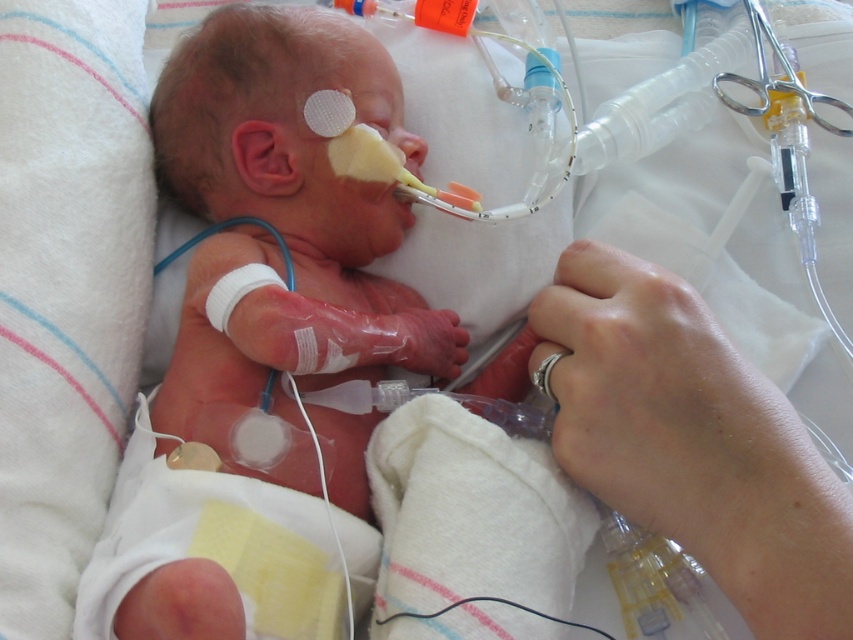
Question: Among these objects, which one is nearest to the camera?

Choices:
 (A) silver metallic teething ring at lower center
 (B) clear plastic tube at lower right

Answer: (B)

Question: Does clear plastic tube at lower right come in front of silver metallic teething ring at lower center?

Choices:
 (A) no
 (B) yes

Answer: (B)

Question: Among these objects, which one is farthest from the camera?

Choices:
 (A) silver metallic teething ring at lower center
 (B) clear plastic tube at lower right

Answer: (A)

Question: Is clear plastic tube at lower right further to the viewer compared to silver metallic teething ring at lower center?

Choices:
 (A) no
 (B) yes

Answer: (A)

Question: Is clear plastic tube at lower right wider than silver metallic teething ring at lower center?

Choices:
 (A) no
 (B) yes

Answer: (B)